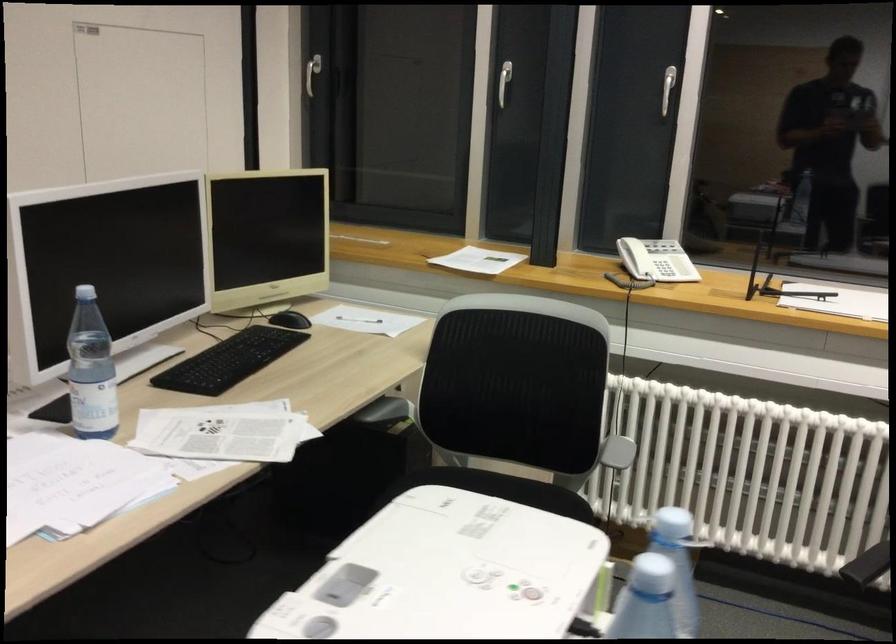
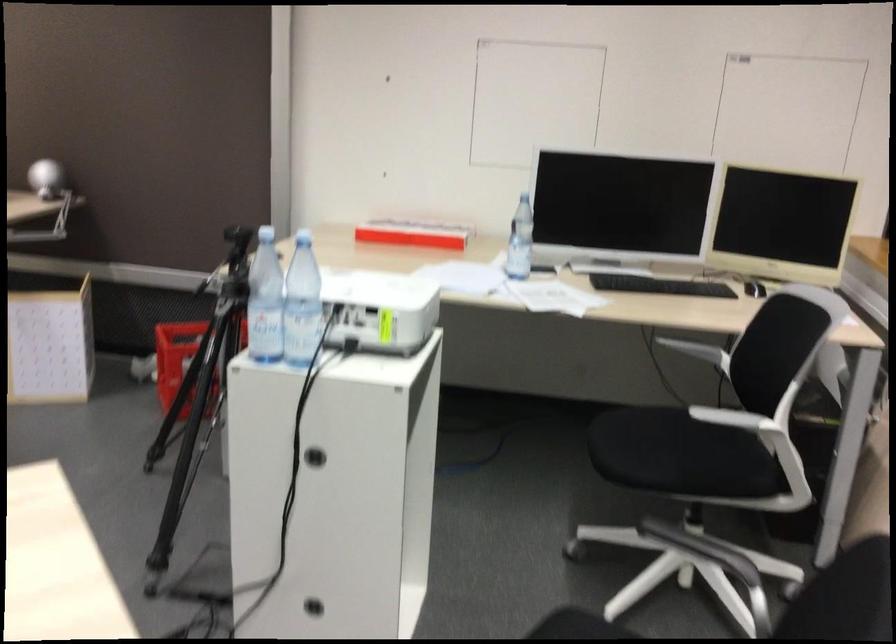
The point at (492,559) is marked in the first image. Where is the corresponding point in the second image?

(380, 308)